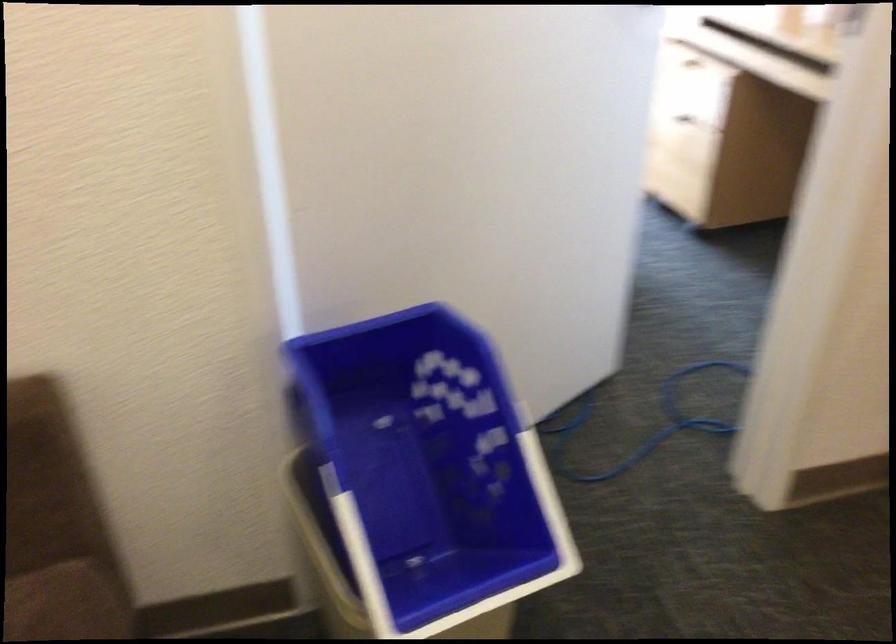
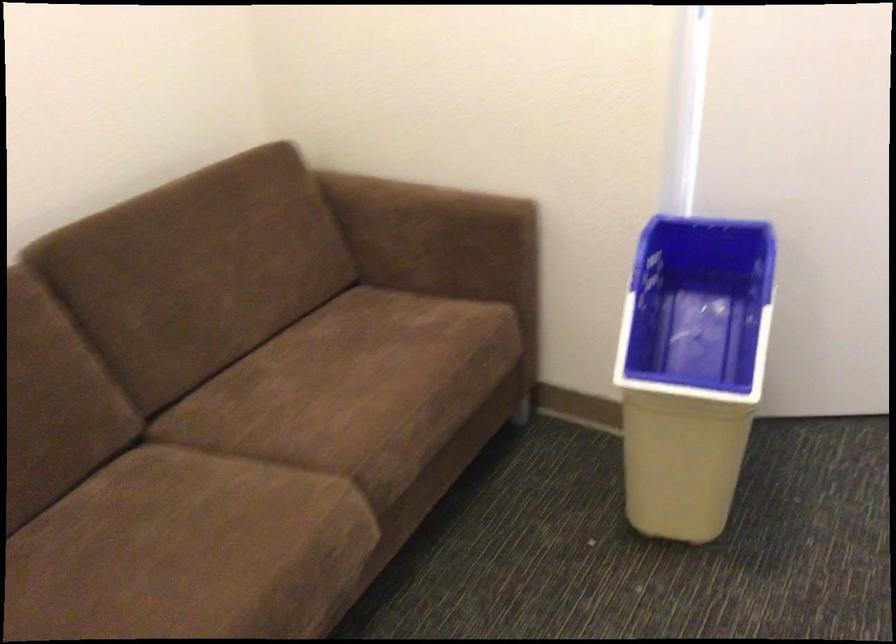
Where in the second image is the point corresponding to (x=392, y=516) from the first image?

(692, 368)